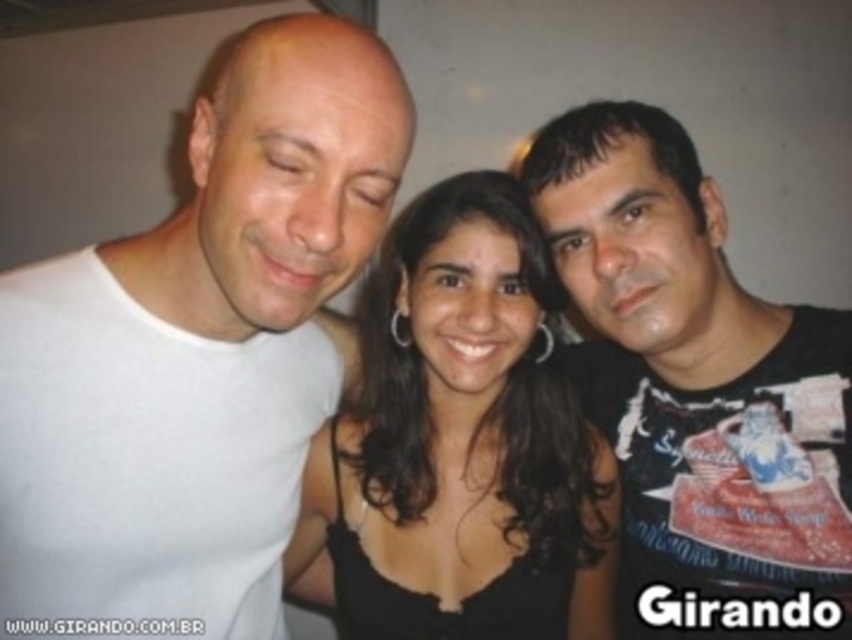
You are taking a photo of three people standing close together. The leftmost person is wearing a white t shirt. Can you determine if the point at coordinates (196, 355) falls on the white matte t shirt at left?

The point at coordinates (196, 355) indicates the white matte t shirt at left, so yes, the point falls on the white matte t shirt at left.

You are taking a photo using a camera. The camera is positioned at a certain distance from the point marked as point (288, 237). If the recommended distance for a clear portrait is 24 inches, will this distance work?

The point (288, 237) and camera are 24.18 inches apart from each other, which is slightly more than the recommended 24 inches. However, this distance should still work for a clear portrait as it is very close to the recommended measurement.